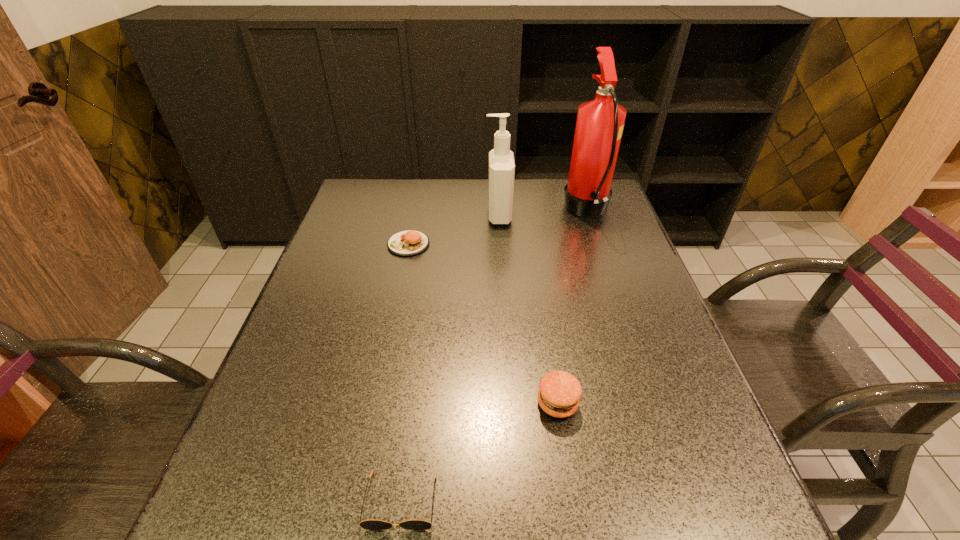
You are a GUI agent. You are given a task and a screenshot of the screen. Output one action in this format:
    pyautogui.click(x=<x>, y=<y>)
    Task: Click on the fire extinguisher
    
    Given the screenshot: What is the action you would take?
    pyautogui.click(x=600, y=122)

This screenshot has height=540, width=960. Identify the location of the tallest object. (600, 122).

Find the location of `the third object from right to left`. the third object from right to left is located at coordinates (501, 175).

This screenshot has height=540, width=960. Identify the location of the fourth shortest object. (501, 175).

Where is `the right patty`? The width and height of the screenshot is (960, 540). the right patty is located at coordinates (559, 392).

The width and height of the screenshot is (960, 540). In order to click on the fourth object from left to right in this screenshot , I will do `click(559, 392)`.

Where is `the farther patty`? The width and height of the screenshot is (960, 540). the farther patty is located at coordinates (409, 242).

The height and width of the screenshot is (540, 960). Identify the location of the shorter patty. (409, 242).

Where is `the nearest object`? the nearest object is located at coordinates pos(366,524).

The height and width of the screenshot is (540, 960). What are the coordinates of `blank space located 0.380m at the spray nozzle of the tallest object` in the screenshot? It's located at (444, 211).